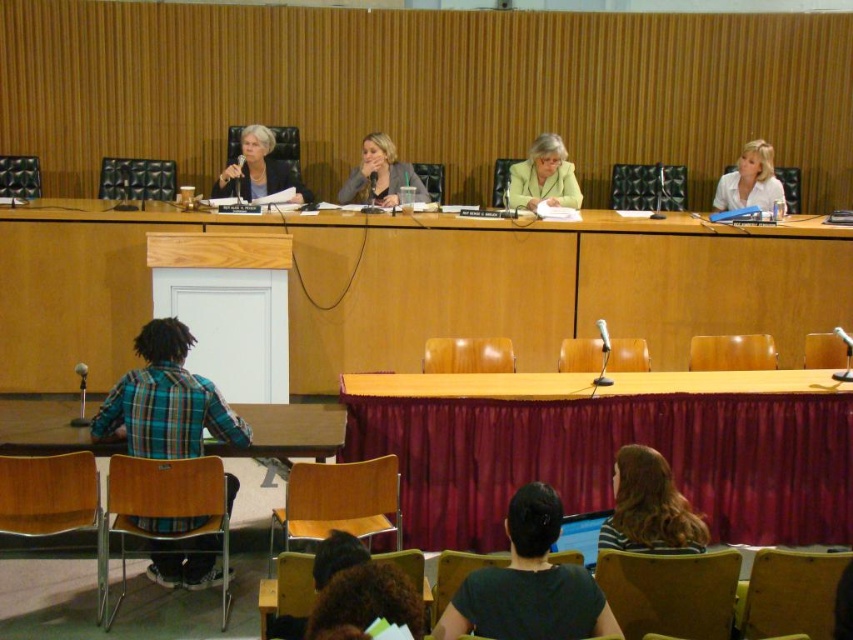
Question: Which of the following is the closest to the observer?

Choices:
 (A) (190, 435)
 (B) (213, 184)
 (C) (651, 461)

Answer: (C)

Question: Which point is closer to the camera?

Choices:
 (A) plaid fabric shirt at lower left
 (B) white matte shirt at upper right
 (C) matte black microphone at center

Answer: (A)

Question: Among these points, which one is farthest from the camera?

Choices:
 (A) click(171, 452)
 (B) click(762, 184)

Answer: (B)

Question: Can you confirm if plaid fabric shirt at lower left is positioned to the left of black fabric shirt at center?

Choices:
 (A) yes
 (B) no

Answer: (A)

Question: Is matte yellow jacket at center wider than matte gray blazer at center?

Choices:
 (A) no
 (B) yes

Answer: (A)

Question: Can you confirm if black fabric shirt at center is smaller than striped fabric shirt at lower center?

Choices:
 (A) no
 (B) yes

Answer: (B)